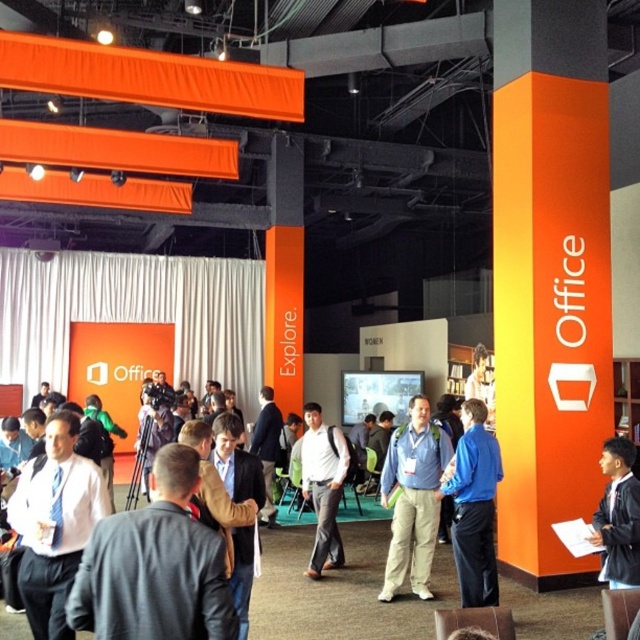
You are attending a conference and need to find your blue fabric backpack at center. According to the map, where is it positioned relative to the entrance?

The blue fabric backpack at center is located at point (x=413, y=499), which is approximately 78.0 cm east and 64.7 cm north from the entrance.

You are at the entrance of the event space and want to find the gray fabric jacket at center. According to the coordinates provided, in which direction should you move relative to your current position?

The gray fabric jacket at center is located at coordinates point (x=156, y=566). Since the coordinate system typically has (x=0, y=0) at the bottom left corner, moving towards the right and slightly upwards from the entrance would lead you to the gray fabric jacket at center.